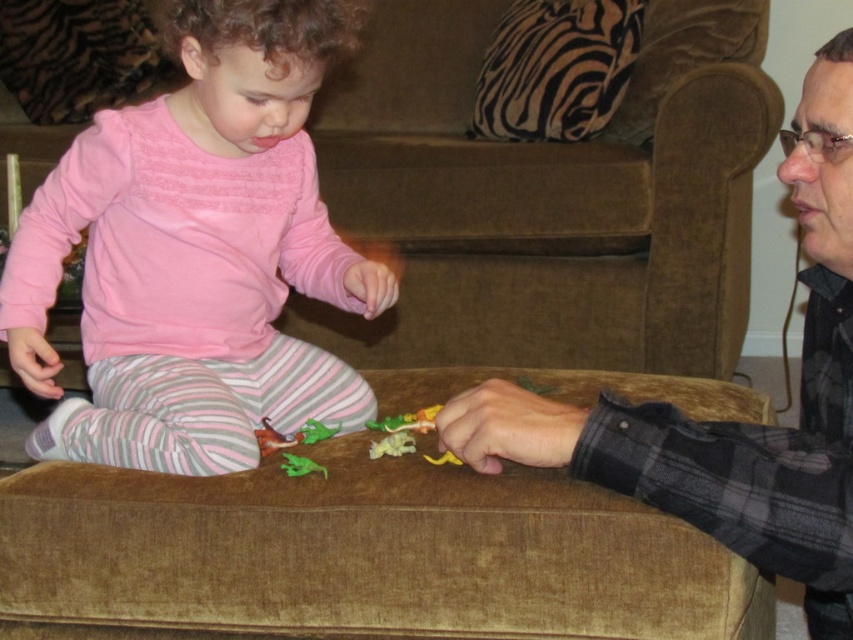
Who is positioned more to the right, pink soft fabric toddler at lower left or matte black shirt at lower right?

matte black shirt at lower right is more to the right.

Which is behind, point (117, 433) or point (601, 472)?

The point (117, 433) is more distant.

Where is `pink soft fabric toddler at lower left`? The height and width of the screenshot is (640, 853). pink soft fabric toddler at lower left is located at coordinates (196, 253).